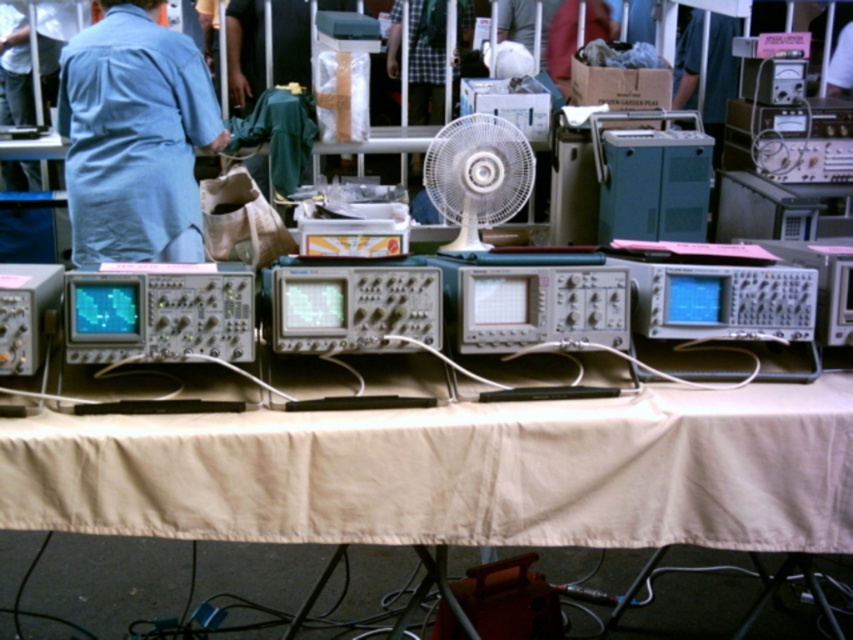
You are at a flea market and see a denim shirt at left and a white plastic fan at center. If you want to carry both items, which one should you pick up first if you want to start with the larger item?

You should pick up the denim shirt at left first because it is bigger than the white plastic fan at center.

You are a customer at the flea market and want to examine both the beige fabric table at center and the white plastic fan at center. Which object should you approach first to get a closer look?

The beige fabric table at center is closer to the viewer than the white plastic fan at center, so you should approach the beige fabric table at center first to examine it more closely.